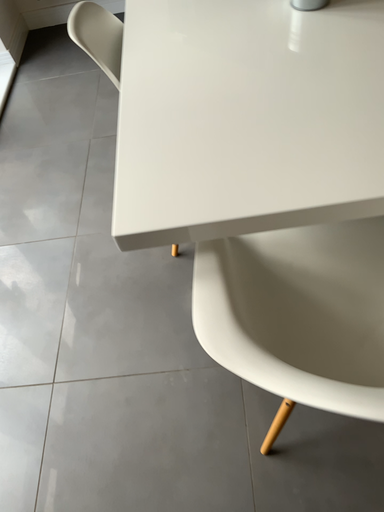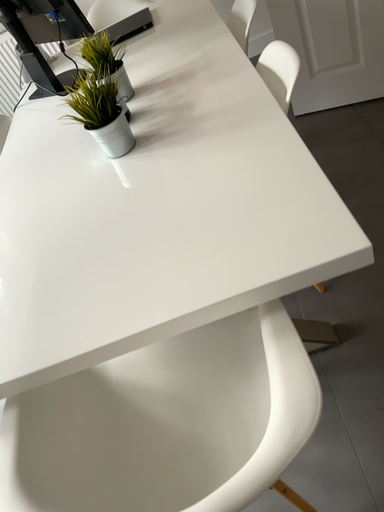
Question: Which way did the camera rotate in the video?

Choices:
 (A) rotated left
 (B) rotated right

Answer: (A)